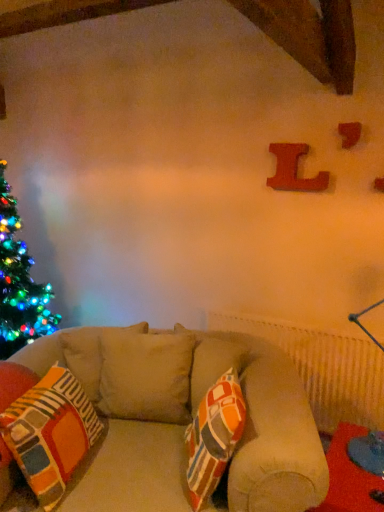
Question: Is red fabric table at lower right looking in the opposite direction of wooden letter l at upper right, the 2th alphabet positioned from the front?

Choices:
 (A) yes
 (B) no

Answer: (B)

Question: Is red fabric table at lower right next to wooden letter l at upper right, the 2th alphabet positioned from the front?

Choices:
 (A) no
 (B) yes

Answer: (A)

Question: From the image's perspective, is red fabric table at lower right located beneath wooden letter l at upper right, the 2th alphabet positioned from the front?

Choices:
 (A) yes
 (B) no

Answer: (A)

Question: Is red fabric table at lower right outside wooden letter l at upper right, the first alphabet viewed from the back?

Choices:
 (A) no
 (B) yes

Answer: (B)

Question: Is red fabric table at lower right thinner than wooden letter l at upper right, the first alphabet viewed from the left?

Choices:
 (A) yes
 (B) no

Answer: (B)

Question: Visually, is red fabric table at lower right positioned to the left or to the right of wooden letter l at upper right, the first alphabet viewed from the back?

Choices:
 (A) right
 (B) left

Answer: (A)

Question: From the image's perspective, is red fabric table at lower right located above or below wooden letter l at upper right, the first alphabet viewed from the back?

Choices:
 (A) below
 (B) above

Answer: (A)

Question: Relative to wooden letter l at upper right, which appears as the second alphabet when viewed from the right, is red fabric table at lower right in front or behind?

Choices:
 (A) behind
 (B) front

Answer: (B)

Question: In terms of width, does red fabric table at lower right look wider or thinner when compared to wooden letter l at upper right, the first alphabet viewed from the left?

Choices:
 (A) wide
 (B) thin

Answer: (A)

Question: Based on their sizes in the image, would you say multicolored fabric pillow at center is bigger or smaller than red fabric table at lower right?

Choices:
 (A) big
 (B) small

Answer: (A)

Question: From the image's perspective, is multicolored fabric pillow at center located above or below red fabric table at lower right?

Choices:
 (A) below
 (B) above

Answer: (B)

Question: Considering the positions of point (29, 436) and point (360, 492), is point (29, 436) closer or farther from the camera than point (360, 492)?

Choices:
 (A) closer
 (B) farther

Answer: (A)

Question: Is multicolored fabric pillow at center inside or outside of red fabric table at lower right?

Choices:
 (A) outside
 (B) inside

Answer: (A)

Question: Visually, is multicolored fabric pillow at center positioned to the left or to the right of wooden letter l at upper right, the first alphabet viewed from the left?

Choices:
 (A) right
 (B) left

Answer: (B)

Question: From the image's perspective, is multicolored fabric pillow at center positioned above or below wooden letter l at upper right, the first alphabet viewed from the left?

Choices:
 (A) below
 (B) above

Answer: (A)